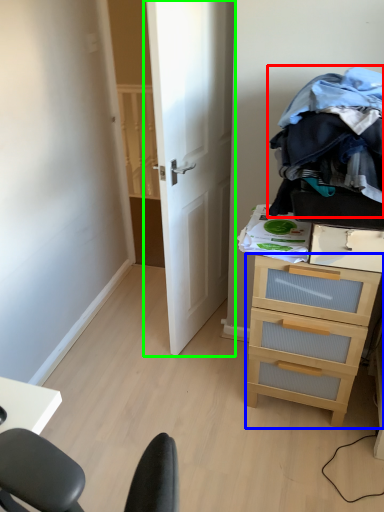
Question: Which object is positioned closest to clothing (highlighted by a red box)? Select from chest of drawers (highlighted by a blue box) and door (highlighted by a green box).

Choices:
 (A) chest of drawers
 (B) door

Answer: (A)